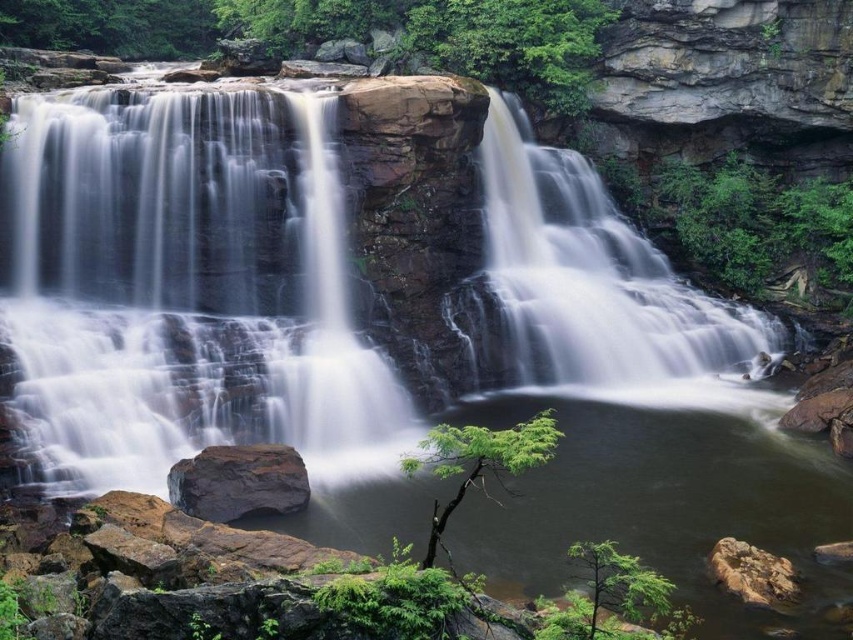
You are a hiker standing at the base of the waterfall. You notice the white smooth waterfall at upper right and the rough textured rock at lower right. Which object is higher in elevation compared to the other?

The white smooth waterfall at upper right is higher in elevation than the rough textured rock at lower right.

You are a hiker who wants to cross from the rough textured rock at lower right to the white smooth waterfall at upper right. Given that your average walking pace is 1.5 meters per second, how many seconds will it take you to reach the waterfall?

The distance between the rough textured rock at lower right and the white smooth waterfall at upper right is 8.72 meters. At a pace of 1.5 meters per second, dividing 8.72 by 1.5 gives approximately 5.81 seconds. Therefore, it will take roughly 6 seconds to reach the waterfall.

Based on the photo, you are a hiker standing at the edge of the waterfall. You notice two rocks in the scene. The smooth dark rock at center and the rough textured rock at lower right. Which rock is closer to you?

The smooth dark rock at center is closer to you than the rough textured rock at lower right.